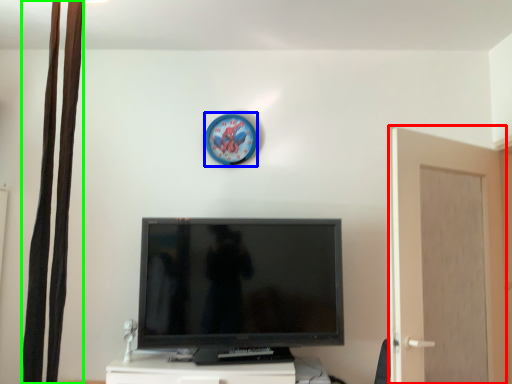
Question: Estimate the real-world distances between objects in this image. Which object is closer to screen door (highlighted by a red box), clock (highlighted by a blue box) or curtain (highlighted by a green box)?

Choices:
 (A) clock
 (B) curtain

Answer: (A)